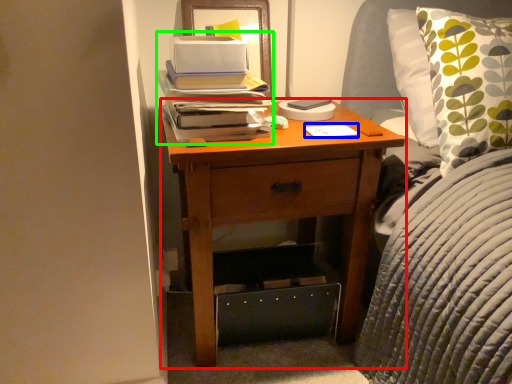
Question: Which object is positioned closest to nightstand (highlighted by a red box)? Select from notepad (highlighted by a blue box) and book (highlighted by a green box).

Choices:
 (A) notepad
 (B) book

Answer: (B)